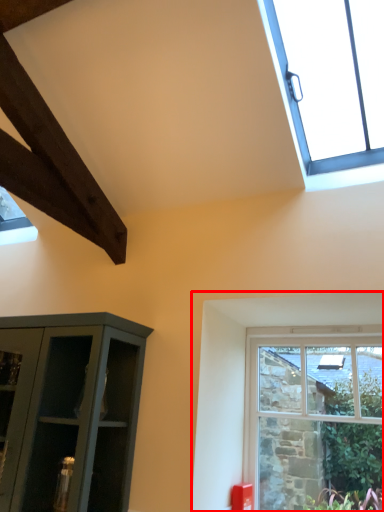
Question: From the image's perspective, considering the relative positions of window (annotated by the red box) and window in the image provided, where is window (annotated by the red box) located with respect to the staircase?

Choices:
 (A) below
 (B) above

Answer: (A)